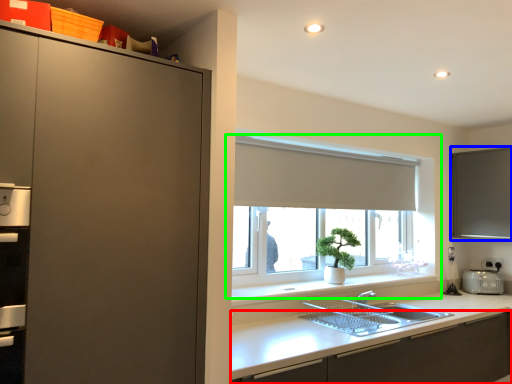
Question: Which object is the farthest from cabinetry (highlighted by a red box)? Choose among these: window screen (highlighted by a blue box) or window (highlighted by a green box).

Choices:
 (A) window screen
 (B) window

Answer: (A)